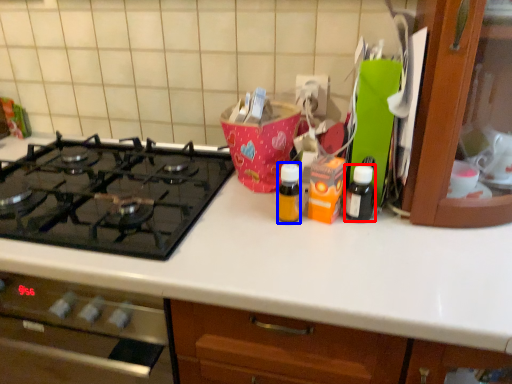
Question: Among these objects, which one is nearest to the camera, bottle (highlighted by a red box) or bottle (highlighted by a blue box)?

Choices:
 (A) bottle
 (B) bottle

Answer: (B)